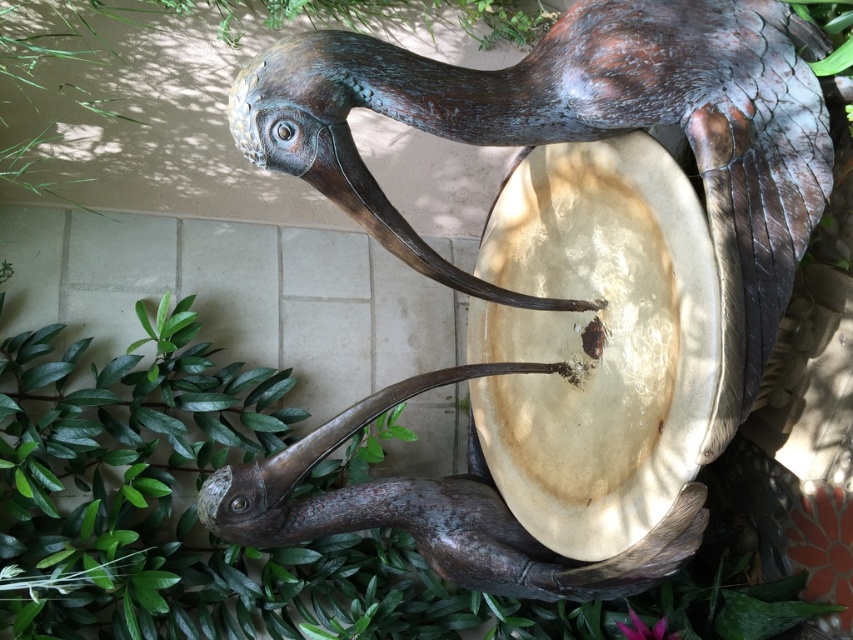
Can you confirm if bronze textured bird at center is positioned to the left of green leafy plant at lower left?

Incorrect, bronze textured bird at center is not on the left side of green leafy plant at lower left.

Is bronze textured bird at center above green leafy plant at lower left?

Correct, bronze textured bird at center is located above green leafy plant at lower left.

Consider the image. Who is more forward, (726, 428) or (115, 620)?

Point (726, 428) is more forward.

Locate an element on the screen. The width and height of the screenshot is (853, 640). bronze textured bird at center is located at coordinates (585, 138).